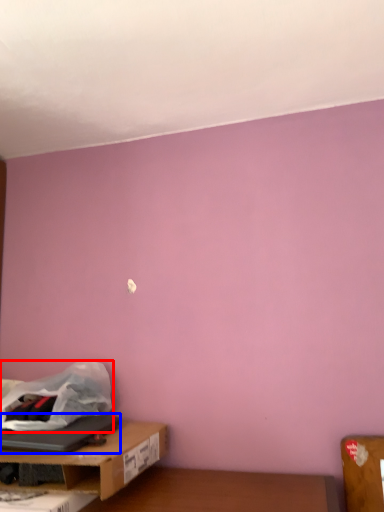
Question: Which object appears closest to the camera in this image, plastic bag (highlighted by a red box) or laptop (highlighted by a blue box)?

Choices:
 (A) plastic bag
 (B) laptop

Answer: (B)